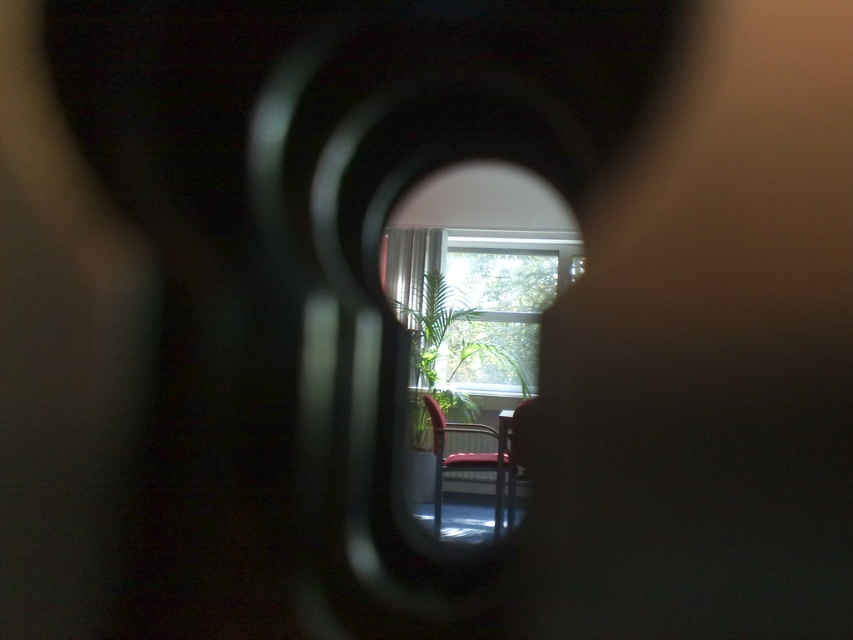
Does transparent glass window at center have a lesser width compared to metallic red chair at center?

No.

In the scene shown: Can you confirm if transparent glass window at center is wider than metallic red chair at center?

Indeed, transparent glass window at center has a greater width compared to metallic red chair at center.

Is point (495, 385) farther from viewer compared to point (437, 531)?

Yes, it is behind point (437, 531).

Image resolution: width=853 pixels, height=640 pixels. Find the location of `transparent glass window at center`. transparent glass window at center is located at coordinates (500, 307).